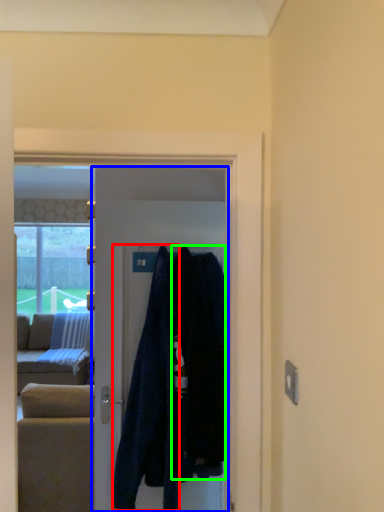
Question: Which object is positioned closest to clothing (highlighted by a red box)? Select from door (highlighted by a blue box) and clothing (highlighted by a green box).

Choices:
 (A) door
 (B) clothing

Answer: (B)